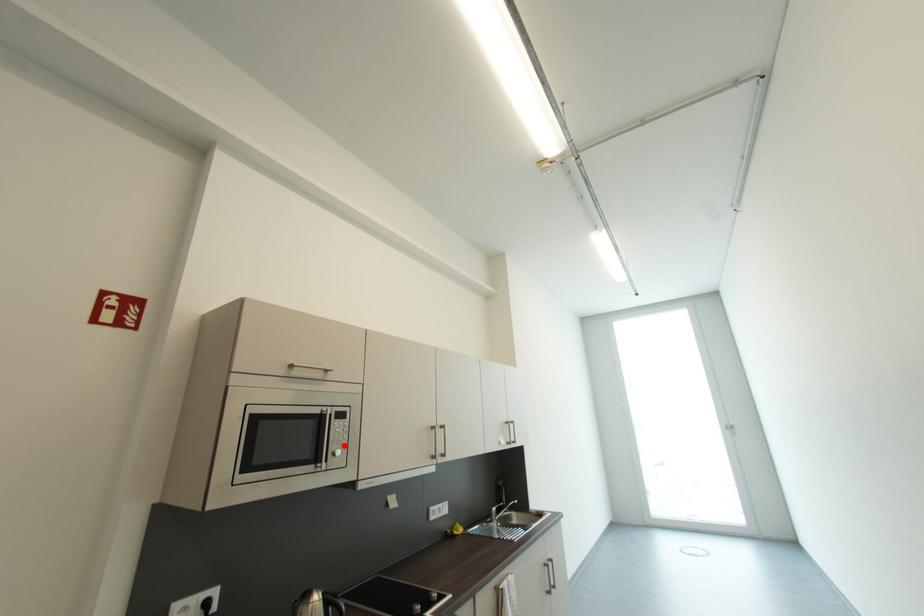
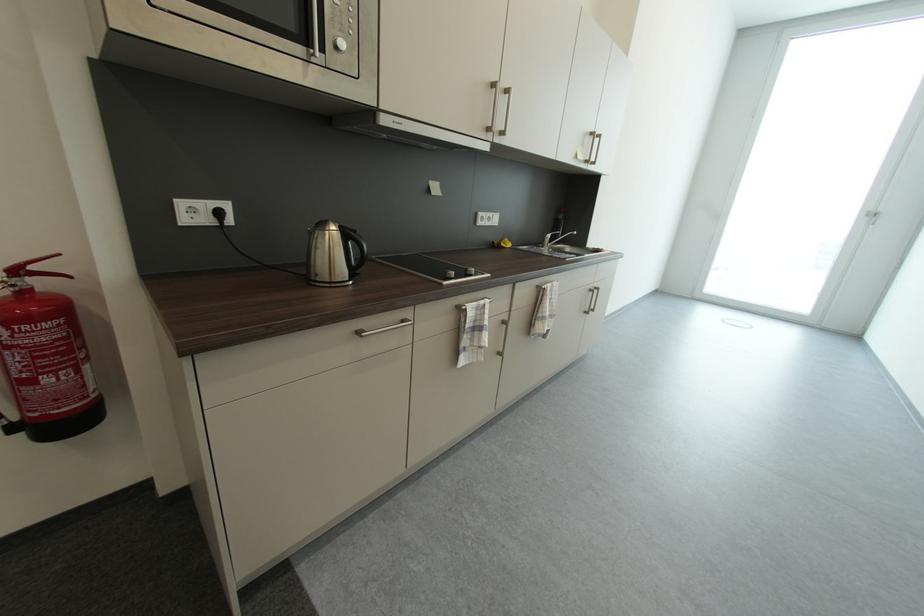
In the second image, find the point that corresponds to the highlighted location in the first image.

(347, 33)